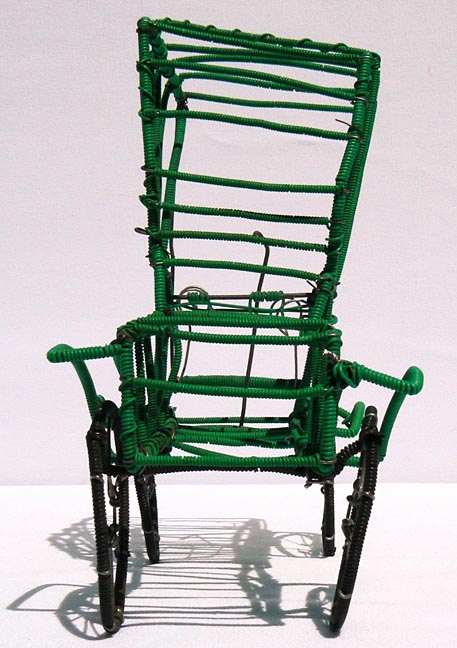
Identify the location of the lower white floor in right lower corner. (437, 638).